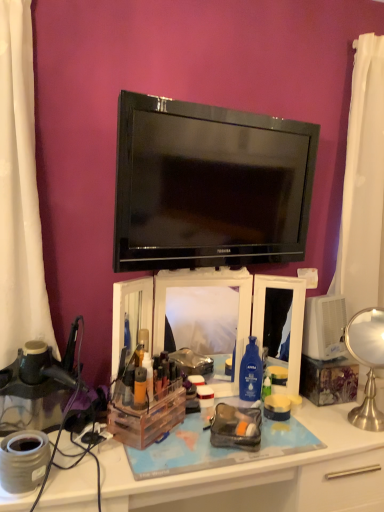
Locate an element on the screen. The width and height of the screenshot is (384, 512). free space above clear plastic organizer at center (from a real-world perspective) is located at coordinates (203, 431).